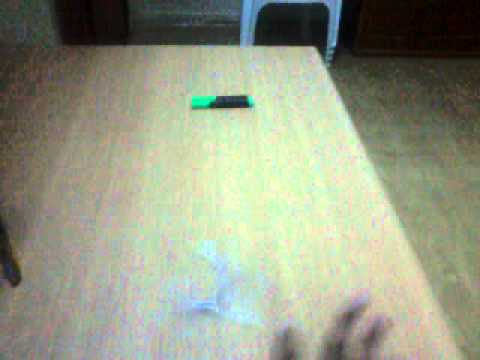
This screenshot has width=480, height=360. Identify the location of wooden shelving. (381, 49).